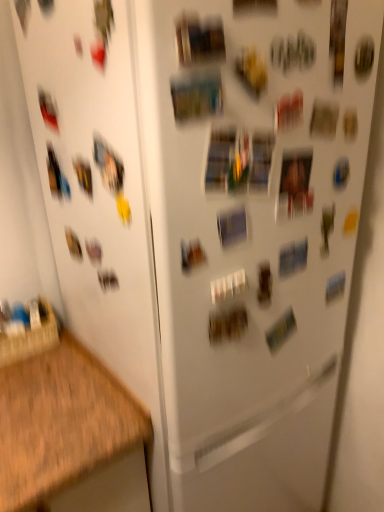
Describe the element at coordinates (96, 190) in the screenshot. The width and height of the screenshot is (384, 512). I see `white matte refrigerator door at left` at that location.

Find the location of a particular element. This screenshot has height=512, width=384. white matte refrigerator door at left is located at coordinates (96, 190).

Find the location of a particular element. This screenshot has width=384, height=512. white matte refrigerator door at left is located at coordinates (96, 190).